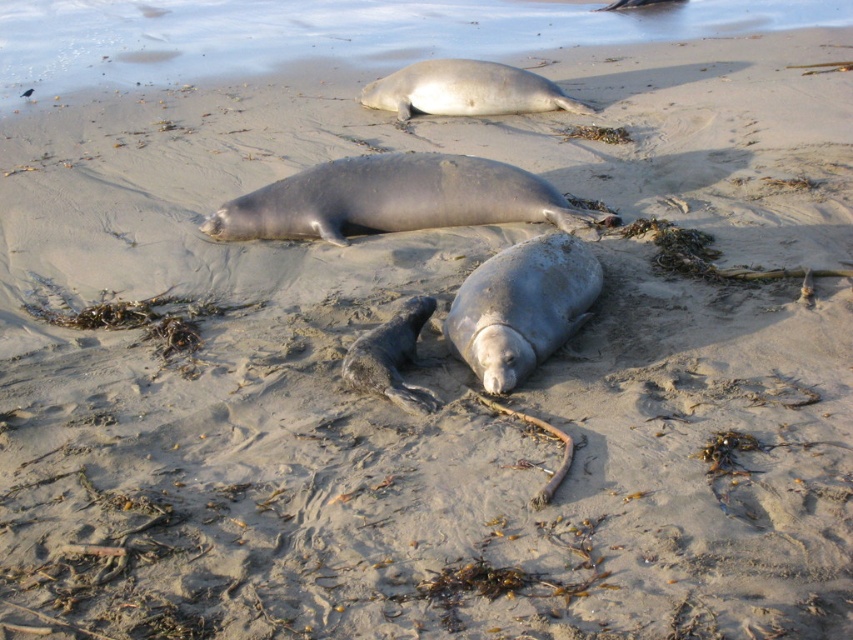
Question: Considering the relative positions of smooth gray seal at center and gray matte seal at upper center in the image provided, where is smooth gray seal at center located with respect to gray matte seal at upper center?

Choices:
 (A) right
 (B) left

Answer: (B)

Question: Among these objects, which one is farthest from the camera?

Choices:
 (A) gray matte seal at upper center
 (B) gray matte seal at center

Answer: (A)

Question: Among these points, which one is farthest from the camera?

Choices:
 (A) (515, 93)
 (B) (318, 209)
 (C) (456, 298)

Answer: (A)

Question: Is gray matte seal at center smaller than gray matte seal at upper center?

Choices:
 (A) yes
 (B) no

Answer: (A)

Question: Where is smooth gray seal at center located in relation to gray matte seal at upper center in the image?

Choices:
 (A) right
 (B) left

Answer: (B)

Question: Which object is the farthest from the smooth gray seal at center?

Choices:
 (A) gray matte seal at upper center
 (B) gray matte seal at center

Answer: (A)